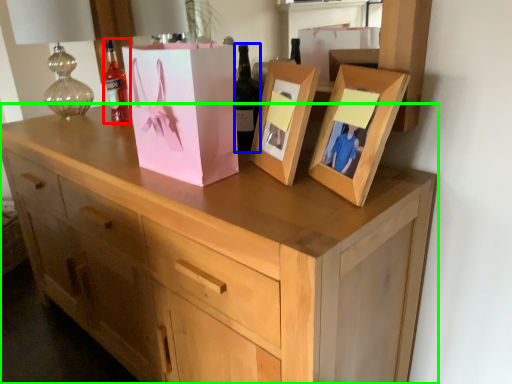
Question: Which object is positioned closest to bottle (highlighted by a red box)? Select from bottle (highlighted by a blue box) and chest of drawers (highlighted by a green box).

Choices:
 (A) bottle
 (B) chest of drawers

Answer: (A)